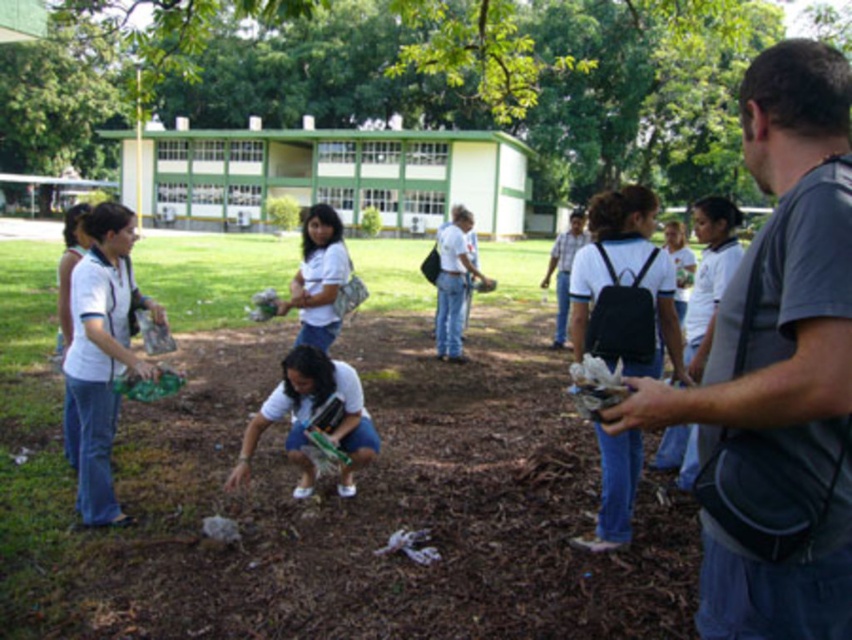
Between white matte shirt at center and white shirt at center, which one has less height?

white matte shirt at center

Can you confirm if white matte shirt at center is positioned above white shirt at center?

No.

This screenshot has height=640, width=852. Identify the location of white matte shirt at center. (318, 276).

Which is more to the right, gray fabric bag at center right or white matte book at center?

From the viewer's perspective, gray fabric bag at center right appears more on the right side.

Is gray fabric bag at center right wider than white matte book at center?

In fact, gray fabric bag at center right might be narrower than white matte book at center.

Where is `gray fabric bag at center right`? The image size is (852, 640). gray fabric bag at center right is located at coordinates (780, 355).

Between gray fabric bag at center right and white matte shirt at center, which one has more height?

Standing taller between the two is gray fabric bag at center right.

Can you confirm if gray fabric bag at center right is shorter than white matte shirt at center?

No.

Who is more distant from viewer, [793,387] or [327,284]?

Point [327,284]

Identify the location of gray fabric bag at center right. (780, 355).